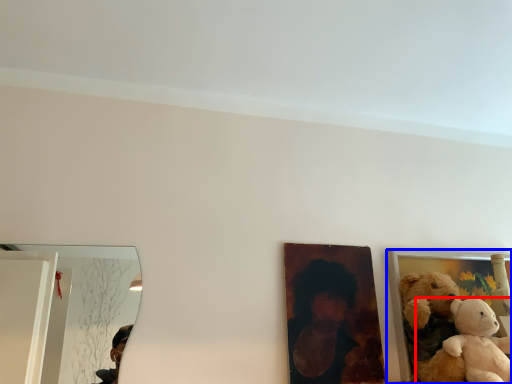
Question: Which of the following is the farthest to the observer, teddy bear (highlighted by a red box) or picture frame (highlighted by a blue box)?

Choices:
 (A) teddy bear
 (B) picture frame

Answer: (B)